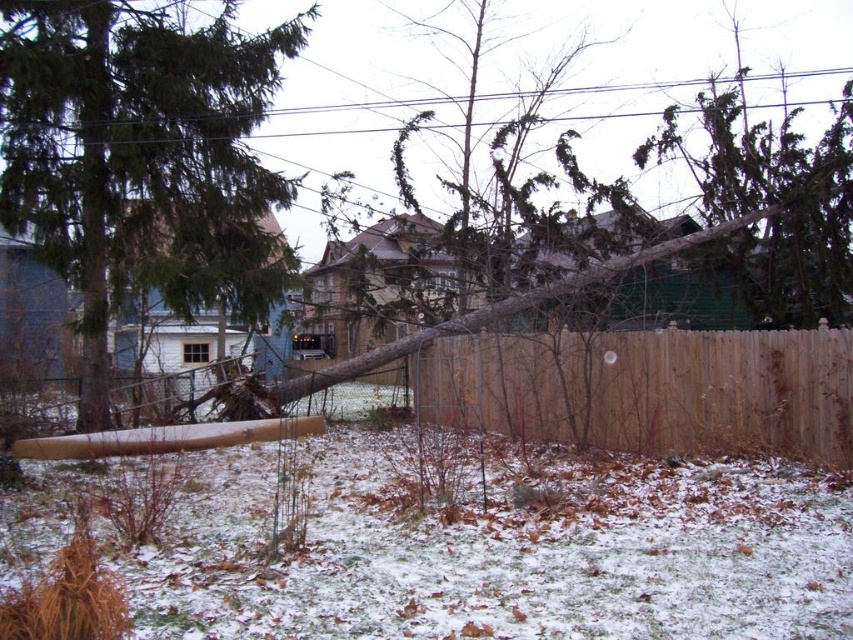
You are standing in the residential area after the storm and want to take a photo of both point (263, 88) and point (595, 381) in the scene. Which point should you focus on first to ensure both are in focus?

You should focus on point (263, 88) first because it is closer to the camera than point (595, 381). By focusing on the closer point, the depth of field may include both points in focus.

You are a city inspector assessing storm damage. You see the green matte tree at center and the brown wood fence at center. Which object is currently lying on top of the other?

The green matte tree at center is positioned over brown wood fence at center, so the tree is lying on top of the fence.